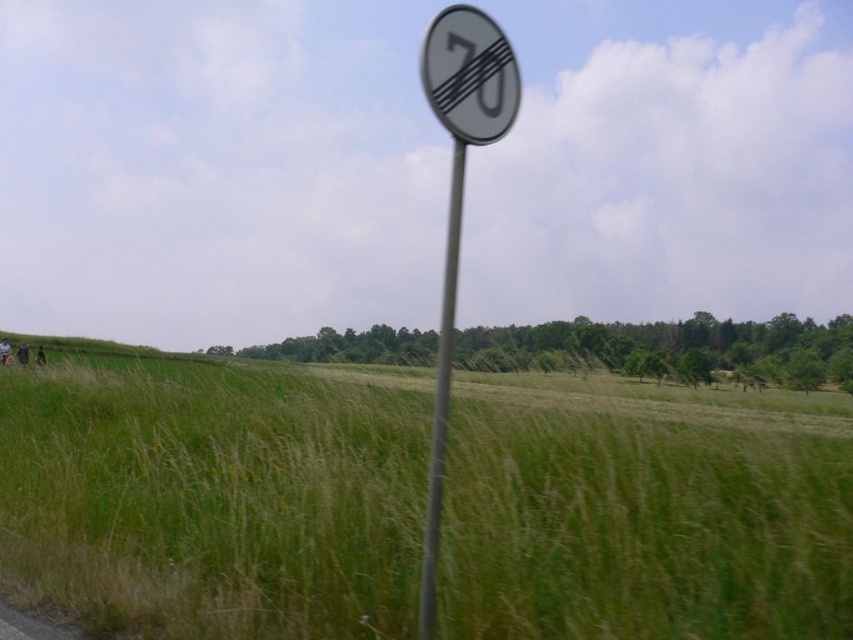
Question: Can you confirm if green grass at center is thinner than white plastic speed limit sign at center?

Choices:
 (A) yes
 (B) no

Answer: (B)

Question: Can you confirm if green grass at center is bigger than white plastic speed limit sign at upper center?

Choices:
 (A) yes
 (B) no

Answer: (A)

Question: Which object appears farthest from the camera in this image?

Choices:
 (A) white plastic speed limit sign at upper center
 (B) green grass at center

Answer: (A)

Question: Based on their relative distances, which object is farther from the white plastic speed limit sign at center?

Choices:
 (A) green grass at center
 (B) white plastic speed limit sign at upper center

Answer: (A)

Question: Where is green grass at center located in relation to metallic pole at center in the image?

Choices:
 (A) left
 (B) right

Answer: (B)

Question: Which object is closer to the camera taking this photo?

Choices:
 (A) white plastic speed limit sign at center
 (B) white plastic speed limit sign at upper center
 (C) green grass at center
 (D) metallic pole at center

Answer: (C)